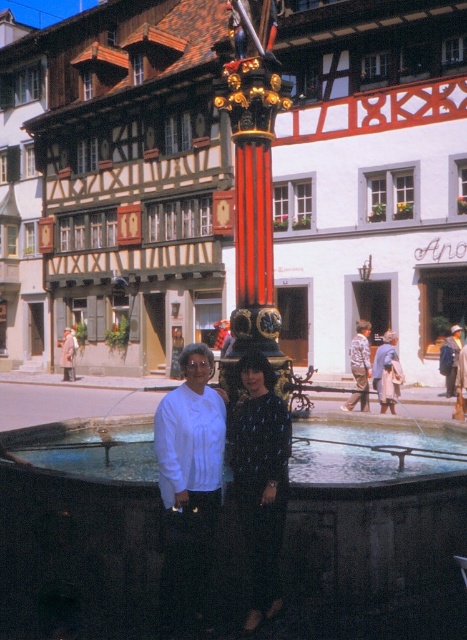
Who is positioned more to the right, light brown leather jacket at center or blue denim jacket at lower right?

Positioned to the right is blue denim jacket at lower right.

Consider the image. How far apart are light brown leather jacket at center and blue denim jacket at lower right?

The distance of light brown leather jacket at center from blue denim jacket at lower right is 19.54 feet.

At what (x,y) coordinates should I click in order to perform the action: click on light brown leather jacket at center. Please return your answer as a coordinate pair (x, y). This screenshot has height=640, width=467. Looking at the image, I should click on (369, 365).

Is matte black dress at center below printed cotton shirt at center?

Actually, matte black dress at center is above printed cotton shirt at center.

Is matte black dress at center above printed cotton shirt at center?

Yes.

Image resolution: width=467 pixels, height=640 pixels. Identify the location of matte black dress at center. tap(387, 372).

Find the location of `matte black dress at center`. matte black dress at center is located at coordinates (387, 372).

Is dark blue textured dress at center bigger than printed cotton shirt at center?

Indeed, dark blue textured dress at center has a larger size compared to printed cotton shirt at center.

The height and width of the screenshot is (640, 467). Identify the location of dark blue textured dress at center. (261, 480).

Locate an element on the screen. Image resolution: width=467 pixels, height=640 pixels. dark blue textured dress at center is located at coordinates click(261, 480).